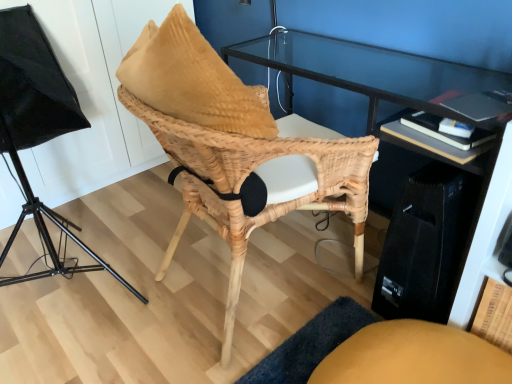
The height and width of the screenshot is (384, 512). I want to click on natural woven chair at center, so click(231, 145).

What do you see at coordinates (231, 145) in the screenshot?
I see `natural woven chair at center` at bounding box center [231, 145].

Measure the distance between point (132, 111) and camera.

The distance of point (132, 111) from camera is 3.29 feet.

The image size is (512, 384). What are the coordinates of `black fabric lampshade at left` in the screenshot? It's located at (37, 127).

Image resolution: width=512 pixels, height=384 pixels. Describe the element at coordinates (37, 127) in the screenshot. I see `black fabric lampshade at left` at that location.

This screenshot has height=384, width=512. Identify the location of natural woven chair at center. (231, 145).

Can you confirm if black fabric lampshade at left is positioned to the right of natural woven chair at center?

In fact, black fabric lampshade at left is to the left of natural woven chair at center.

Which object is more forward, black fabric lampshade at left or natural woven chair at center?

black fabric lampshade at left.

Does point (76, 266) lie in front of point (353, 198)?

That is False.

From the image's perspective, is black fabric lampshade at left above or below natural woven chair at center?

black fabric lampshade at left is situated higher than natural woven chair at center in the image.

From a real-world perspective, is black fabric lampshade at left over natural woven chair at center?

Yes.

In terms of width, does black fabric lampshade at left look wider or thinner when compared to natural woven chair at center?

Considering their sizes, black fabric lampshade at left looks broader than natural woven chair at center.

Between black fabric lampshade at left and natural woven chair at center, which one has more height?

Standing taller between the two is black fabric lampshade at left.

Looking at the image, does black fabric lampshade at left seem bigger or smaller compared to natural woven chair at center?

Considering their sizes, black fabric lampshade at left takes up more space than natural woven chair at center.

Would you say natural woven chair at center is part of black fabric lampshade at left's contents?

That's incorrect, natural woven chair at center is not inside black fabric lampshade at left.

Would you say black fabric lampshade at left is a long distance from natural woven chair at center?

No, black fabric lampshade at left is not far away from natural woven chair at center.

Does black fabric lampshade at left turn towards natural woven chair at center?

No, black fabric lampshade at left does not turn towards natural woven chair at center.

How different are the orientations of black fabric lampshade at left and natural woven chair at center in degrees?

There is a 77.9-degree angle between the facing directions of black fabric lampshade at left and natural woven chair at center.

Measure the distance between black fabric lampshade at left and natural woven chair at center.

black fabric lampshade at left and natural woven chair at center are 29.62 inches apart from each other.

Identify the location of lamp in front of the natural woven chair at center. (37, 127).

In the image, is natural woven chair at center on the left side or the right side of black fabric lampshade at left?

Based on their positions, natural woven chair at center is located to the right of black fabric lampshade at left.

Considering the positions of objects natural woven chair at center and black fabric lampshade at left in the image provided, who is behind, natural woven chair at center or black fabric lampshade at left?

natural woven chair at center.

Which is closer to the camera, (175,128) or (30,84)?

Point (175,128) is closer to the camera than point (30,84).

From the image's perspective, which one is positioned higher, natural woven chair at center or black fabric lampshade at left?

black fabric lampshade at left appears higher in the image.

From a real-world perspective, which object stands above the other?

black fabric lampshade at left, from a real-world perspective.

Which of these two, natural woven chair at center or black fabric lampshade at left, is thinner?

Thinner between the two is natural woven chair at center.

From the picture: Considering the sizes of natural woven chair at center and black fabric lampshade at left in the image, is natural woven chair at center taller or shorter than black fabric lampshade at left?

Considering their sizes, natural woven chair at center has less height than black fabric lampshade at left.

Can you confirm if natural woven chair at center is smaller than black fabric lampshade at left?

Indeed, natural woven chair at center has a smaller size compared to black fabric lampshade at left.

Is natural woven chair at center located outside black fabric lampshade at left?

Yes.

Are natural woven chair at center and black fabric lampshade at left far apart?

That's not correct — natural woven chair at center is a little close to black fabric lampshade at left.

Could you tell me if natural woven chair at center is turned towards black fabric lampshade at left?

No, natural woven chair at center does not turn towards black fabric lampshade at left.

Looking at this image, can you tell me how much natural woven chair at center and black fabric lampshade at left differ in facing direction?

natural woven chair at center and black fabric lampshade at left are facing 77.9 degrees away from each other.

You are a GUI agent. You are given a task and a screenshot of the screen. Output one action in this format:
    pyautogui.click(x=<x>, y=<y>)
    Task: Click on the chair to the right of black fabric lampshade at left
    This screenshot has height=384, width=512.
    Given the screenshot: What is the action you would take?
    pyautogui.click(x=231, y=145)

The height and width of the screenshot is (384, 512). I want to click on lamp lying in front of the natural woven chair at center, so click(37, 127).

Locate an element on the screen. This screenshot has width=512, height=384. lamp that is above the natural woven chair at center (from the image's perspective) is located at coordinates (37, 127).